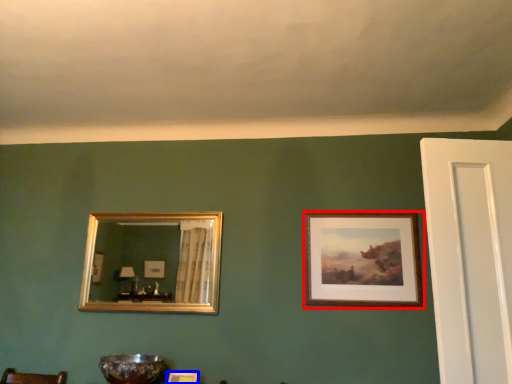
Question: Among these objects, which one is nearest to the camera, picture frame (highlighted by a red box) or picture frame (highlighted by a blue box)?

Choices:
 (A) picture frame
 (B) picture frame

Answer: (B)